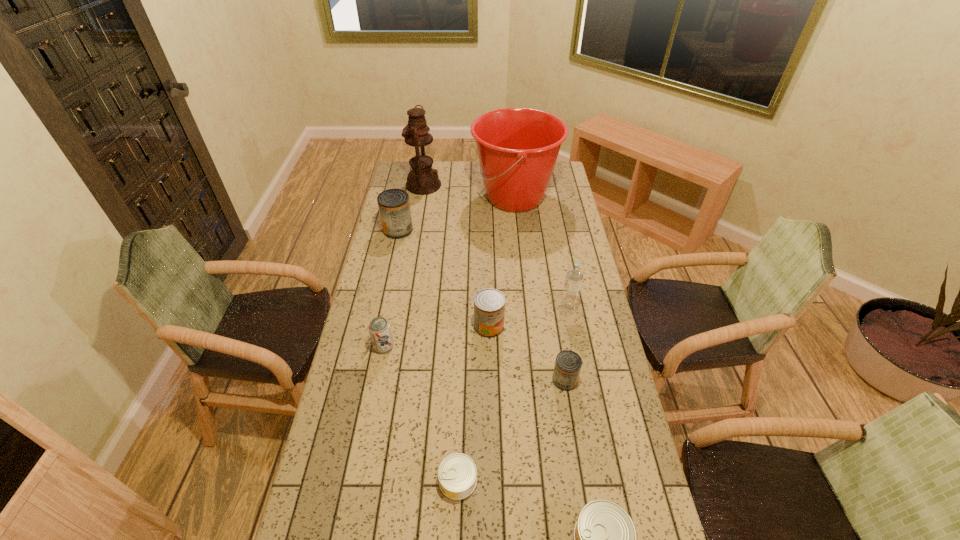
The image size is (960, 540). Identify the location of object that is at the far left corner. (422, 180).

This screenshot has height=540, width=960. Identify the location of object located at the far right corner. (517, 148).

In the image, there is a desktop. Where is `vacant space at the far edge`? vacant space at the far edge is located at coordinates (438, 163).

At what (x,y) coordinates should I click in order to perform the action: click on free region at the left edge of the desktop. Please return your answer as a coordinate pair (x, y). The width and height of the screenshot is (960, 540). Looking at the image, I should click on (388, 394).

In the image, there is a desktop. What are the coordinates of `vacant space at the right edge` in the screenshot? It's located at (590, 484).

In the image, there is a desktop. Identify the location of vacant space at the far left corner. Image resolution: width=960 pixels, height=540 pixels. (400, 179).

Identify the location of vacant space that's between the smaller silver can and the second nearest red can. (473, 403).

Where is `vacant area that lies between the third shortest can and the sixth farthest object`? This screenshot has height=540, width=960. vacant area that lies between the third shortest can and the sixth farthest object is located at coordinates (474, 363).

Find the location of a particular element. free point between the oil lamp and the second tallest can is located at coordinates (456, 255).

This screenshot has height=540, width=960. I want to click on empty space between the sixth farthest object and the tallest can, so click(391, 288).